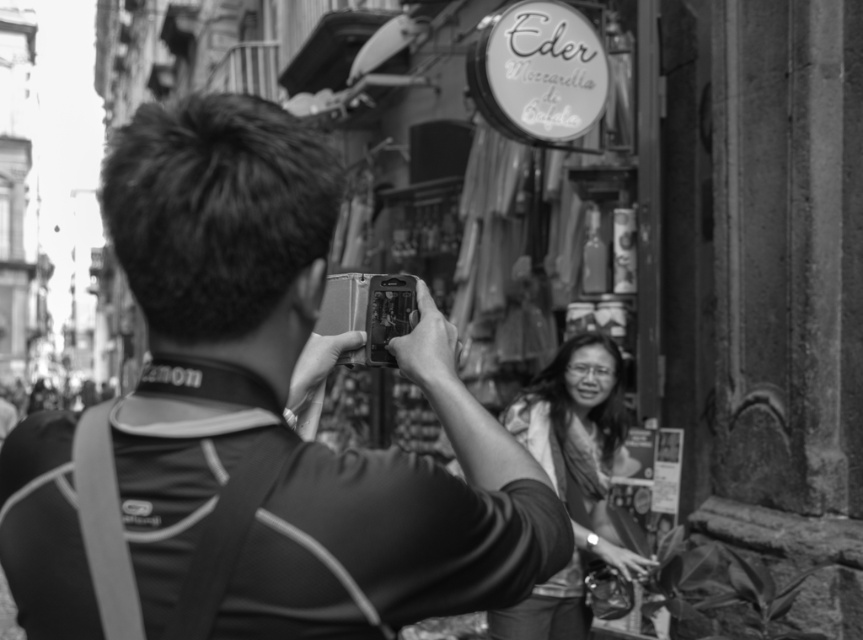
You are a photographer trying to capture the storefront in the background. Since you have the matte black camera at center and the smooth fabric blouse at center in your view, which object should you adjust to ensure the storefront is in focus?

The matte black camera at center is in front of the smooth fabric blouse at center. To focus on the storefront, you should move the matte black camera at center out of the way so it doesn

You are a photographer trying to position your matte black camera at center to capture the storefront sign. Based on the coordinates provided, is the camera positioned to the left or right of the center of the image?

The coordinates for the matte black camera at center are at point 0.637 on the x and 0.331 on the y. Since the x value is greater than 0.5, the camera is positioned to the right of the center of the image.

You are a photographer trying to frame a shot of both the matte black camera at center and the smooth fabric blouse at center. Which object should you adjust your camera angle to focus on first if you want to capture both in the same frame?

The matte black camera at center is to the left of the smooth fabric blouse at center, so you should focus on the smooth fabric blouse at center first to ensure both are in frame.